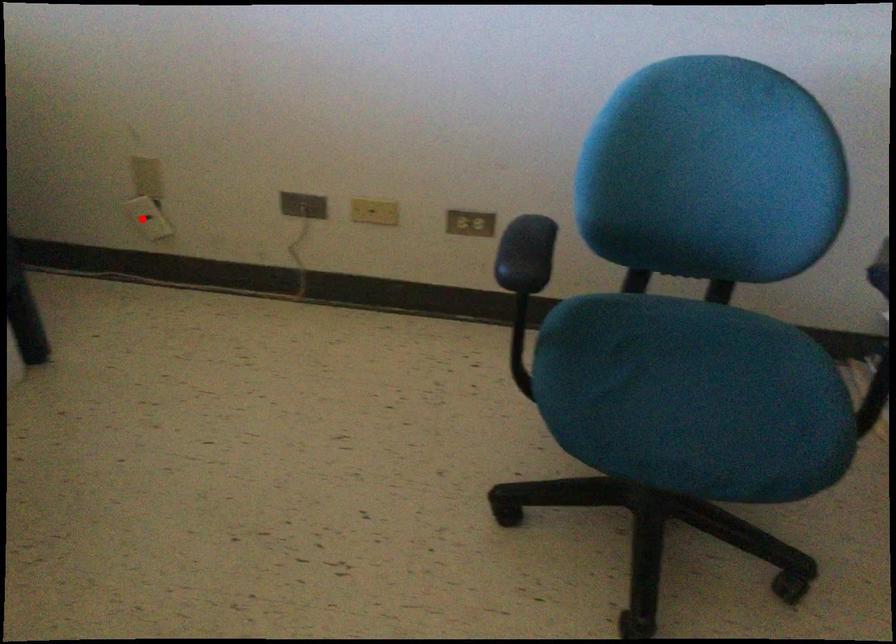
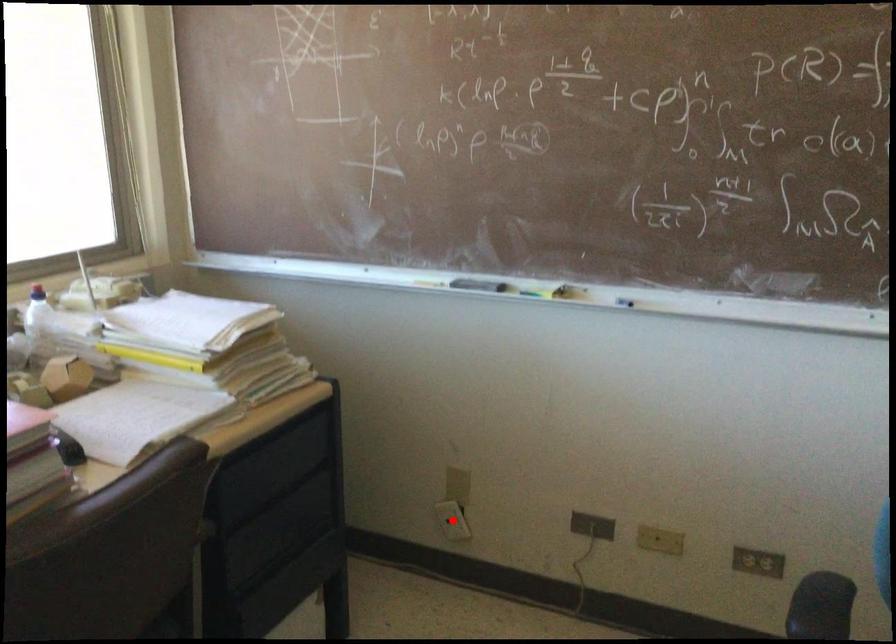
I am providing you with two images of the same scene from different viewpoints. A red point is marked on the first image and another point is marked on the second image. Does the point marked in image1 correspond to the same location as the one in image2?

Yes